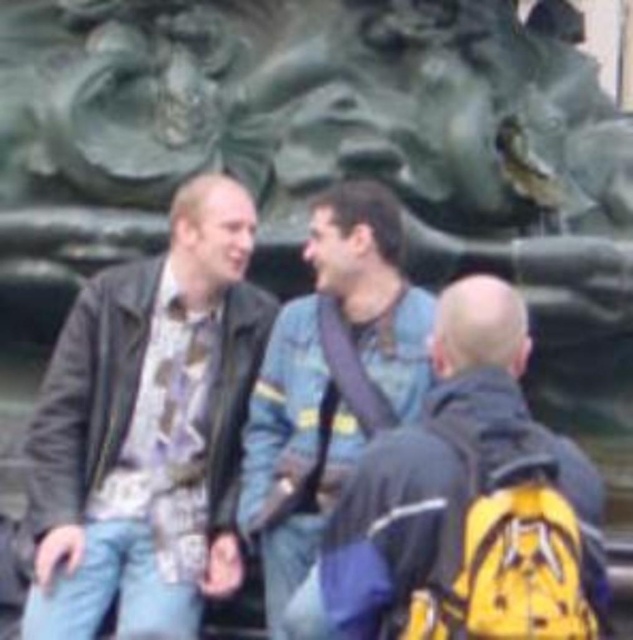
You are a photographer trying to capture a group photo of the matte black jacket at center and the denim jacket at center. The camera you are using has a maximum focus range of 3 meters. Will you be able to include both subjects in the photo without moving closer?

The matte black jacket at center and denim jacket at center are 3.55 meters apart from each other. Since the camera can only focus up to 3 meters, the distance between them exceeds the focus range. Therefore, you cannot include both subjects in the photo without moving closer.

In the scene shown: You are taking a photo of the three people sitting outdoors. You want to focus on the person closest to the camera. Which point should you focus on, point (x=294, y=621) or point (x=363, y=435)?

Point (x=294, y=621) is closer to the camera than point (x=363, y=435), so you should focus on point (x=294, y=621) to capture the person closest to the camera.